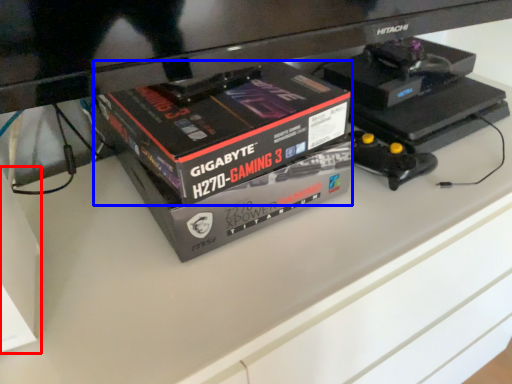
Question: Which object appears closest to the camera in this image, box (highlighted by a red box) or box (highlighted by a blue box)?

Choices:
 (A) box
 (B) box

Answer: (A)